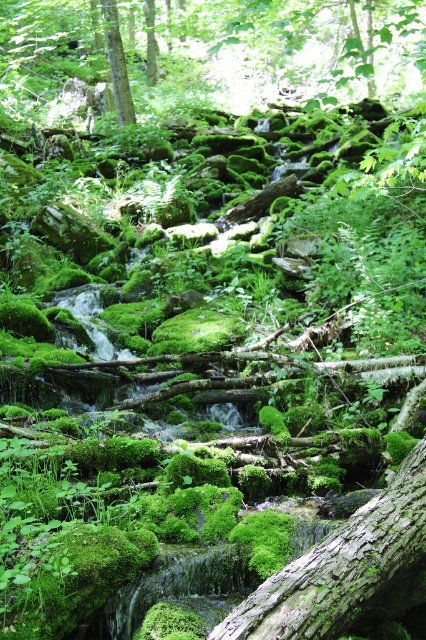
Question: From the image, what is the correct spatial relationship of green mossy log at center in relation to green mossy tree at upper center?

Choices:
 (A) above
 (B) below

Answer: (B)

Question: Does green mossy log at center have a lesser width compared to green mossy tree at upper center?

Choices:
 (A) no
 (B) yes

Answer: (A)

Question: Which of the following is the closest to the observer?

Choices:
 (A) (339, 573)
 (B) (124, 72)

Answer: (A)

Question: Which of the following is the farthest from the observer?

Choices:
 (A) green mossy log at center
 (B) green mossy tree at upper center

Answer: (B)

Question: Which of the following is the farthest from the observer?

Choices:
 (A) green mossy log at center
 (B) green mossy tree at upper center

Answer: (B)

Question: Is green mossy log at center below green mossy tree at upper center?

Choices:
 (A) no
 (B) yes

Answer: (B)